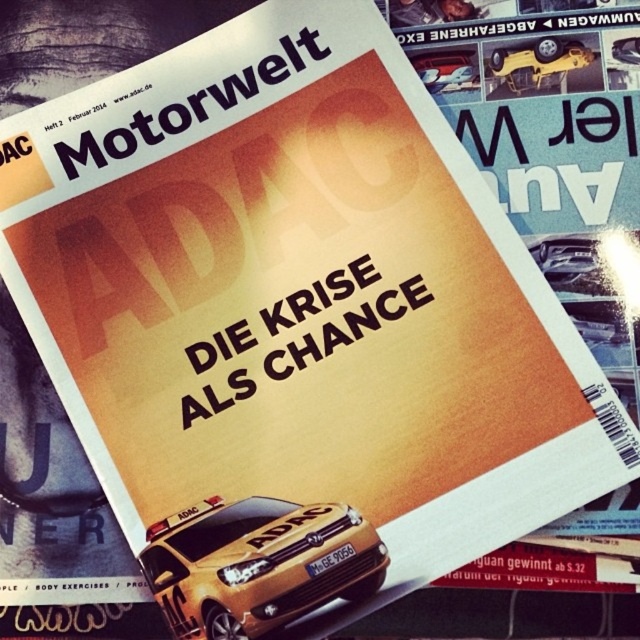
In the scene shown: Can you confirm if metallic gold car at center is shorter than metallic silver car at upper center?

In fact, metallic gold car at center may be taller than metallic silver car at upper center.

Is metallic gold car at center below metallic silver car at upper center?

Yes.

Is point (192, 612) positioned before point (451, 60)?

Yes, it is.

Where is `metallic gold car at center`? The image size is (640, 640). metallic gold car at center is located at coordinates (257, 564).

Consider the image. Does metallic gold car at center come in front of yellow matte car at upper center?

Yes.

Between metallic gold car at center and yellow matte car at upper center, which one is positioned lower?

metallic gold car at center is below.

Is point (180, 572) positioned behind point (573, 68)?

No, (180, 572) is closer to viewer.

Find the location of a particular element. The image size is (640, 640). metallic gold car at center is located at coordinates (257, 564).

Which of these two, yellow matte car at upper center or metallic silver car at upper center, stands shorter?

Standing shorter between the two is metallic silver car at upper center.

Who is positioned more to the left, yellow matte car at upper center or metallic silver car at upper center?

metallic silver car at upper center

Is point (572, 65) more distant than point (433, 84)?

No.

This screenshot has width=640, height=640. Find the location of `yellow matte car at upper center`. yellow matte car at upper center is located at coordinates (538, 64).